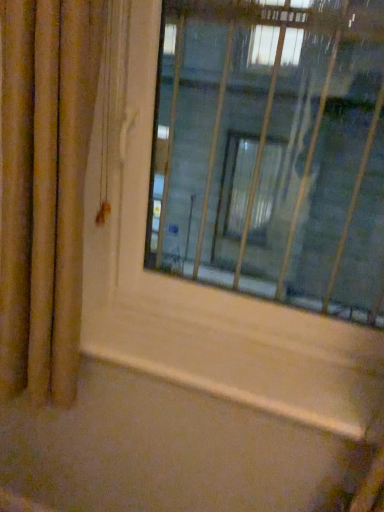
What are the coordinates of `free space above wooden at lower center (from a real-world perspective)` in the screenshot? It's located at (218, 354).